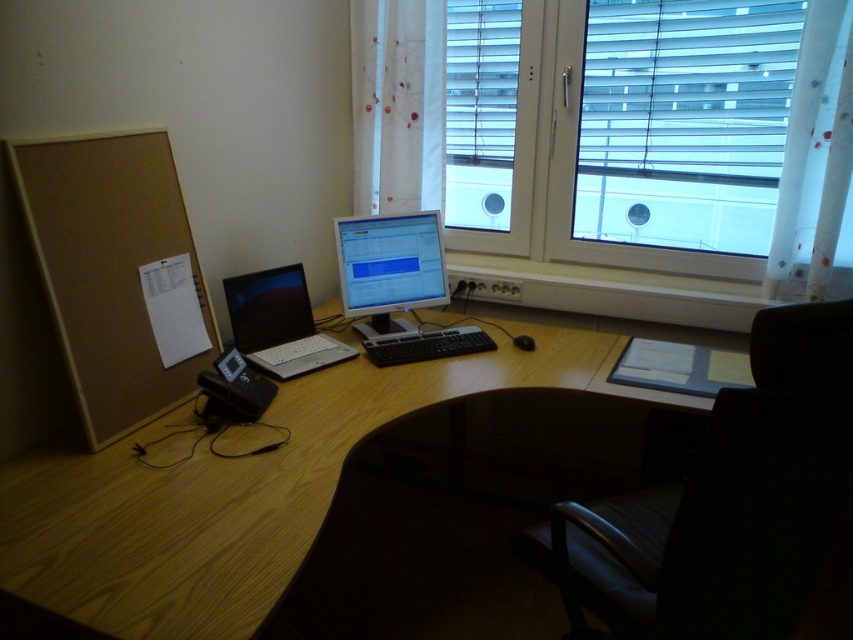
Is the position of satin silver laptop at left more distant than that of black matte mouse at center?

No, it is in front of black matte mouse at center.

Is satin silver laptop at left closer to camera compared to black matte mouse at center?

That is True.

Where is `satin silver laptop at left`? The height and width of the screenshot is (640, 853). satin silver laptop at left is located at coordinates (279, 323).

This screenshot has width=853, height=640. Identify the location of satin silver laptop at left. (279, 323).

Between black leather swivel chair at lower right and satin silver laptop at left, which one appears on the right side from the viewer's perspective?

black leather swivel chair at lower right is more to the right.

Is black leather swivel chair at lower right wider than satin silver laptop at left?

Yes.

Who is more forward, (x=776, y=525) or (x=299, y=284)?

Point (x=776, y=525) is in front.

Locate an element on the screen. Image resolution: width=853 pixels, height=640 pixels. black leather swivel chair at lower right is located at coordinates (722, 502).

Does black leather swivel chair at lower right appear over matte silver monitor at center?

Incorrect, black leather swivel chair at lower right is not positioned above matte silver monitor at center.

Where is `black leather swivel chair at lower right`? The image size is (853, 640). black leather swivel chair at lower right is located at coordinates (722, 502).

The height and width of the screenshot is (640, 853). Identify the location of black leather swivel chair at lower right. (722, 502).